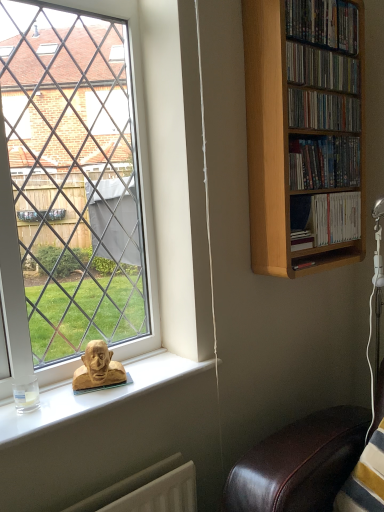
Question: Looking at the image, does wooden dvds at upper right, which is counted as the 5th book, starting from the bottom, seem bigger or smaller compared to matte wooden shelf at upper right, the 2th book from the bottom?

Choices:
 (A) big
 (B) small

Answer: (B)

Question: From a real-world perspective, is wooden dvds at upper right, which is counted as the 5th book, starting from the bottom, positioned above or below matte wooden shelf at upper right, the 2th book from the bottom?

Choices:
 (A) above
 (B) below

Answer: (A)

Question: Which object is positioned farthest from the translucent glass coffee cup at lower left?

Choices:
 (A) matte wooden shelf at upper right, which ranks as the fourth book in top-to-bottom order
 (B) white paperbacks at upper right, the first book in the bottom-to-top sequence
 (C) wooden sculpture at window
 (D) wooden dvds at upper right, which is the third book from top to bottom
 (E) wooden shelf at upper right, which is counted as the fourth book, starting from the bottom

Answer: (E)

Question: Which object is the closest to the white paperbacks at upper right, the first book in the bottom-to-top sequence?

Choices:
 (A) wooden dvds at upper right, which is counted as the 5th book, starting from the bottom
 (B) translucent glass coffee cup at lower left
 (C) light brown wooden bookcase at right
 (D) wooden sculpture at window
 (E) wooden dvds at upper right, arranged as the 3th book when ordered from the bottom

Answer: (C)